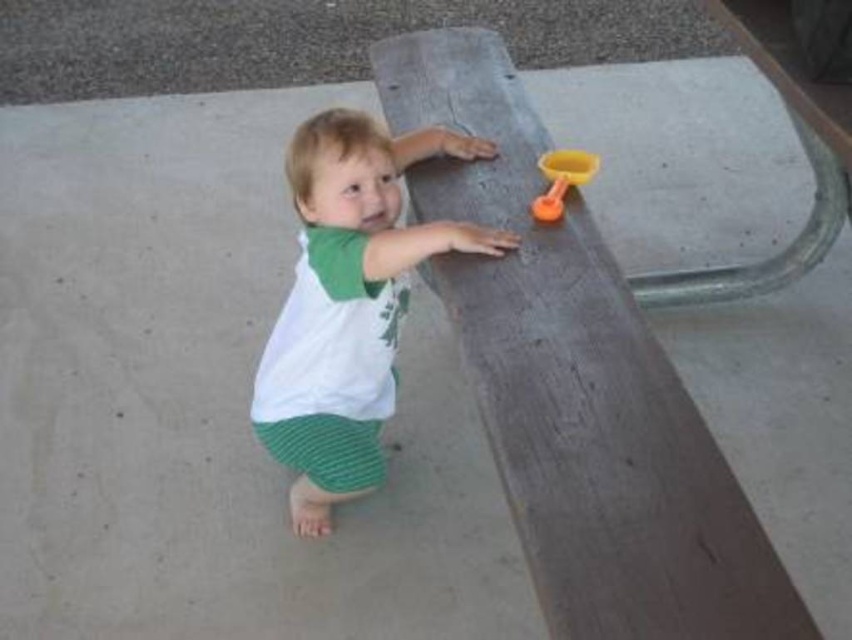
Please describe the exact position of the white cotton shirt at center in the image using coordinates. The scene is a young child standing on a concrete surface, leaning against a wooden plank that appears to be part of a larger structure, possibly a play area or sandbox. The child is wearing a white shirt with green accents and green striped shorts. Their bare feet are visible, and they seem to be reaching out towards a small yellow plastic toy, which resembles a shovel or scoop, placed on the wooden plank

The white cotton shirt at center is located at coordinates point (349, 301).

You are a photographer trying to capture a candid shot of the white cotton shirt at center and the brown wood picnic table at center. Since you want to focus on the shirt, should you adjust your camera to focus on the foreground or background?

The brown wood picnic table at center is in front of the white cotton shirt at center, so to focus on the shirt, you should adjust your camera to focus on the foreground.